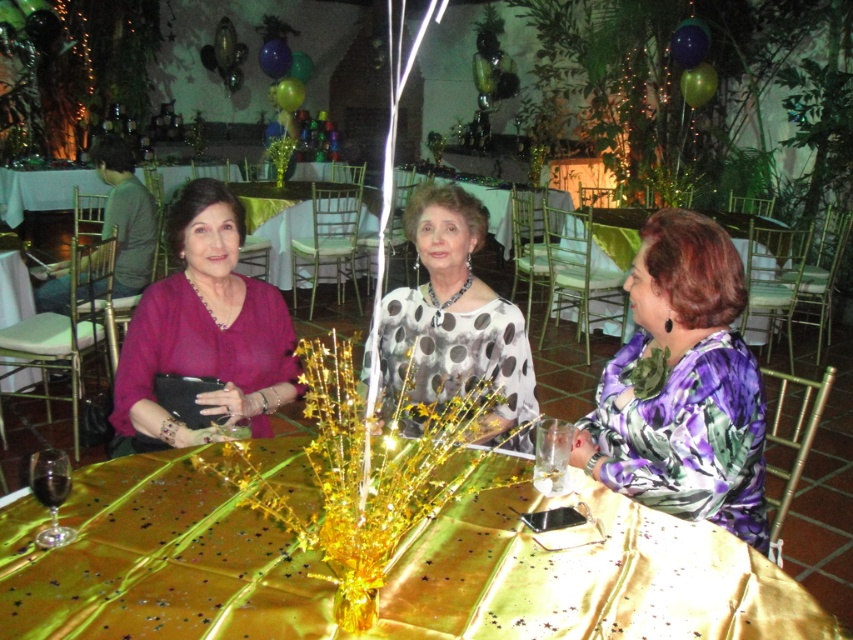
You are a photographer at the event and need to position your camera to capture both the polka dot blouse at center and the transparent glass at center in the same frame. Which object should you place on the left side of your camera frame to ensure both are visible?

You should place the polka dot blouse at center on the left side of your camera frame since it is already positioned to the left of the transparent glass at center, ensuring both are captured in the same shot.

You are a photographer standing in the banquet hall and want to take a photo of the gold satin table at center. If your camera has a maximum focus range of 5 meters, will you need to move closer to capture the table clearly?

The gold satin table at center is 5.57 meters away from the viewer. Since the camera can only focus up to 5 meters, you need to move closer to ensure the table is within the focus range.